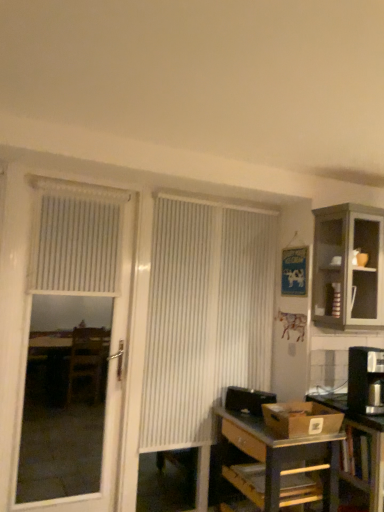
Question: Considering the relative sizes of metallic gray desk at lower right and white textured blind at upper left in the image provided, is metallic gray desk at lower right shorter than white textured blind at upper left?

Choices:
 (A) no
 (B) yes

Answer: (A)

Question: From a real-world perspective, is metallic gray desk at lower right under white textured blind at upper left?

Choices:
 (A) yes
 (B) no

Answer: (A)

Question: Is white textured blind at upper left surrounded by metallic gray desk at lower right?

Choices:
 (A) no
 (B) yes

Answer: (A)

Question: From a real-world perspective, is metallic gray desk at lower right positioned over white textured blind at upper left based on gravity?

Choices:
 (A) no
 (B) yes

Answer: (A)

Question: Considering the relative sizes of metallic gray desk at lower right and white textured blind at upper left in the image provided, is metallic gray desk at lower right smaller than white textured blind at upper left?

Choices:
 (A) yes
 (B) no

Answer: (B)

Question: Considering the relative sizes of metallic gray desk at lower right and white textured blind at upper left in the image provided, is metallic gray desk at lower right wider than white textured blind at upper left?

Choices:
 (A) yes
 (B) no

Answer: (A)

Question: Is metallic silver table at lower right facing towards metallic gray desk at lower right?

Choices:
 (A) yes
 (B) no

Answer: (B)

Question: Can you confirm if metallic silver table at lower right is positioned to the left of metallic gray desk at lower right?

Choices:
 (A) yes
 (B) no

Answer: (B)

Question: From a real-world perspective, is metallic silver table at lower right under metallic gray desk at lower right?

Choices:
 (A) no
 (B) yes

Answer: (A)

Question: Is metallic silver table at lower right in contact with metallic gray desk at lower right?

Choices:
 (A) no
 (B) yes

Answer: (A)

Question: Is metallic silver table at lower right further to camera compared to metallic gray desk at lower right?

Choices:
 (A) yes
 (B) no

Answer: (A)

Question: Considering the relative positions of metallic silver table at lower right and metallic gray desk at lower right in the image provided, is metallic silver table at lower right to the right of metallic gray desk at lower right from the viewer's perspective?

Choices:
 (A) no
 (B) yes

Answer: (B)

Question: Is metallic silver table at lower right at the right side of white vertical blinds at center?

Choices:
 (A) yes
 (B) no

Answer: (A)